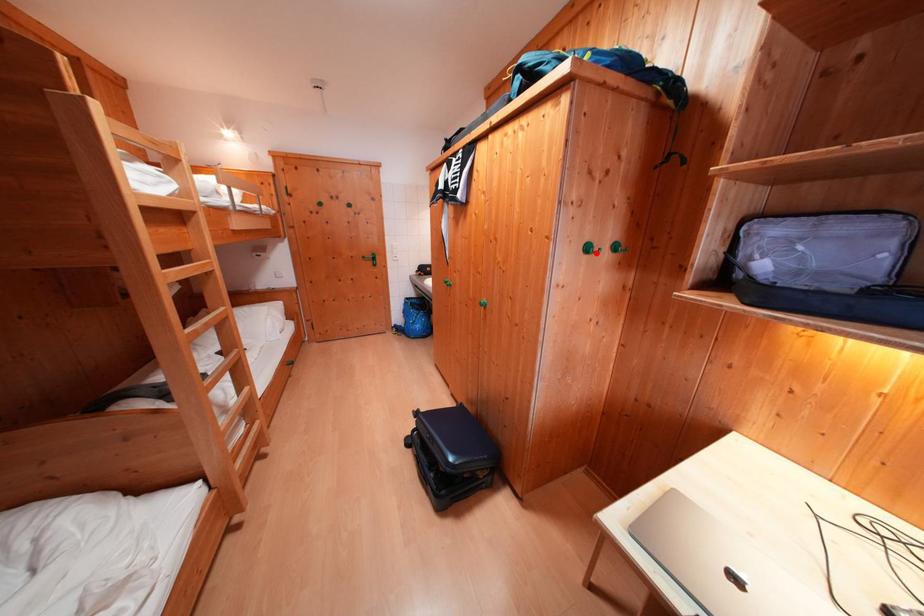
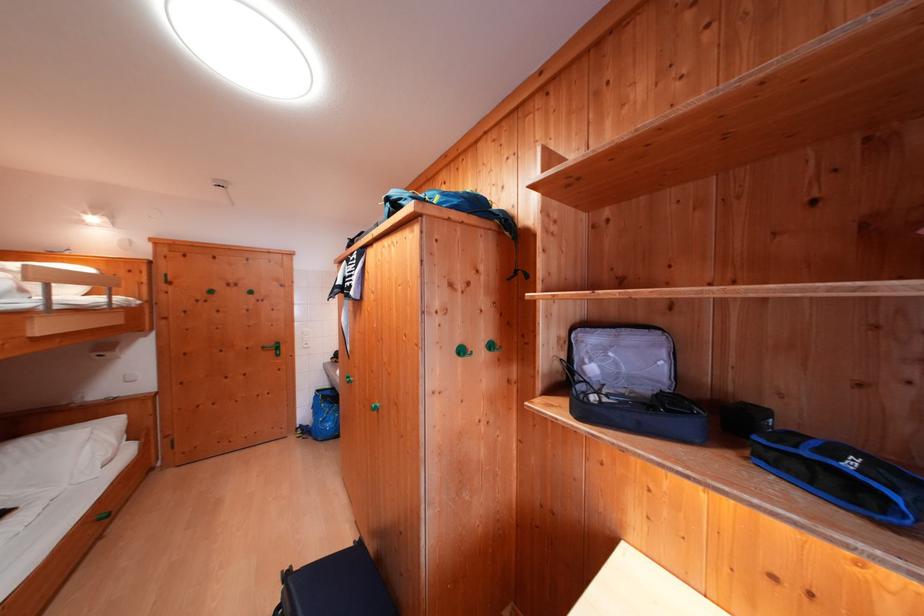
Where in the second image is the point corresponding to the highlighted location from the first image?

(469, 355)